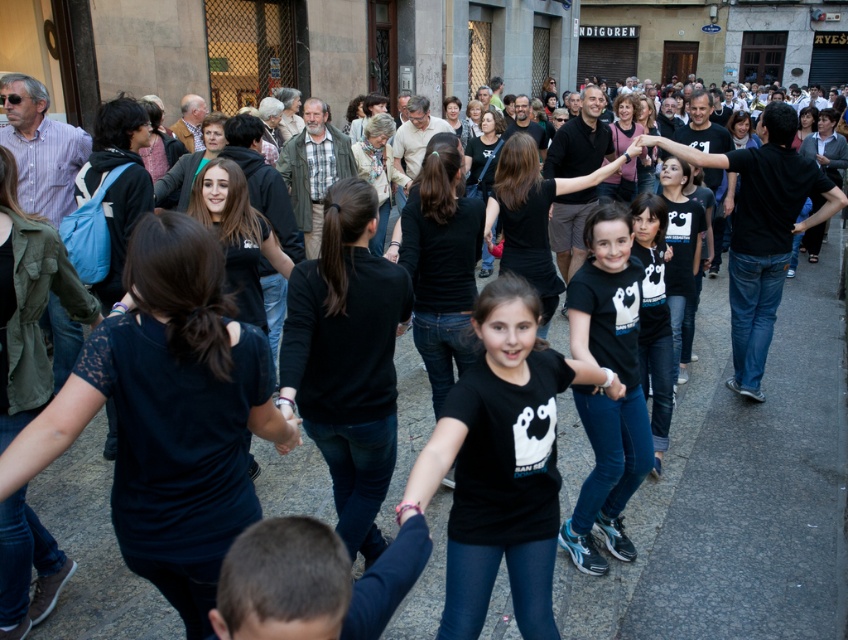
You are a photographer standing on the gray concrete pavement at center. You want to take a photo of the black matte shirt at center. Since you are on the pavement, do you need to look up or down to frame the shirt in your camera?

The gray concrete pavement at center is located below the black matte shirt at center, so you need to look up to frame the shirt in your camera.

You are a photographer trying to capture a photo of the black matte shirt at center and the gray concrete pavement at center. Which object is closer to the camera?

The black matte shirt at center is closer to the camera than the gray concrete pavement at center because the gray concrete pavement at center is shorter than the black matte shirt at center.

You are standing on the gray concrete pavement at center and want to see the black matte shirt at center. Can you see it without moving your head?

The black matte shirt at center is behind the gray concrete pavement at center, so you cannot see it without moving your head.